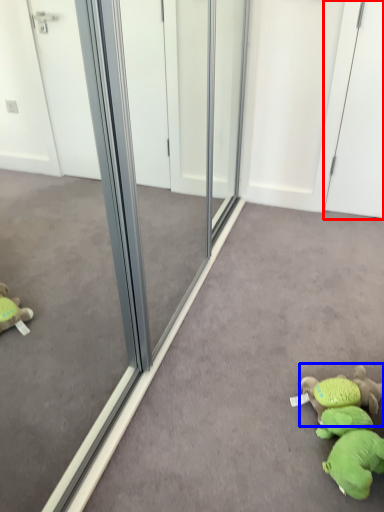
Question: Which point is further to the camera, screen door (highlighted by a red box) or toy (highlighted by a blue box)?

Choices:
 (A) screen door
 (B) toy

Answer: (A)